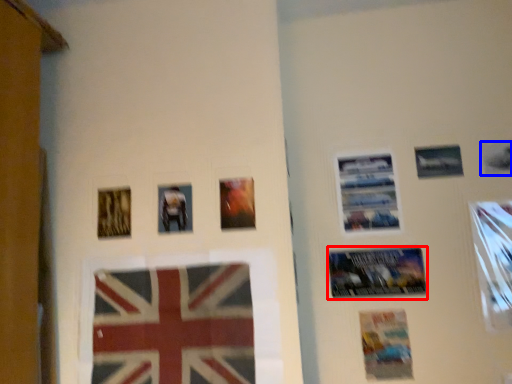
Question: Which of the following is the farthest to the observer, poster (highlighted by a red box) or picture frame (highlighted by a blue box)?

Choices:
 (A) poster
 (B) picture frame

Answer: (B)